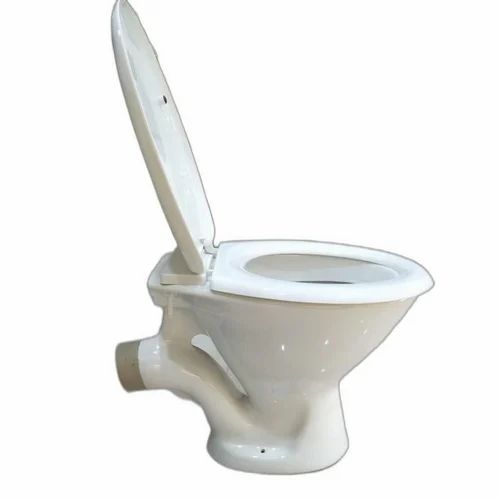
This screenshot has width=500, height=500. What are the coordinates of `screw hole` in the screenshot? It's located at (263, 450).